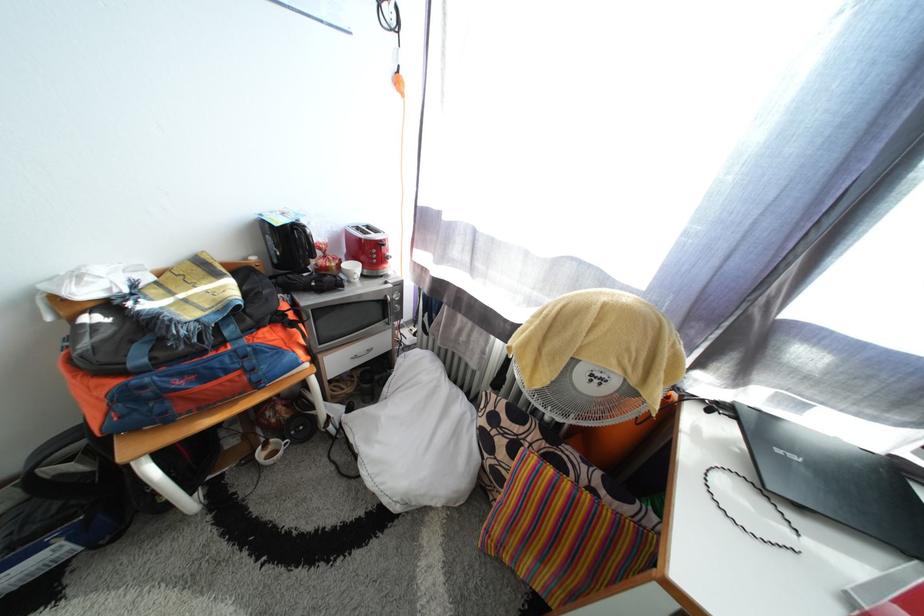
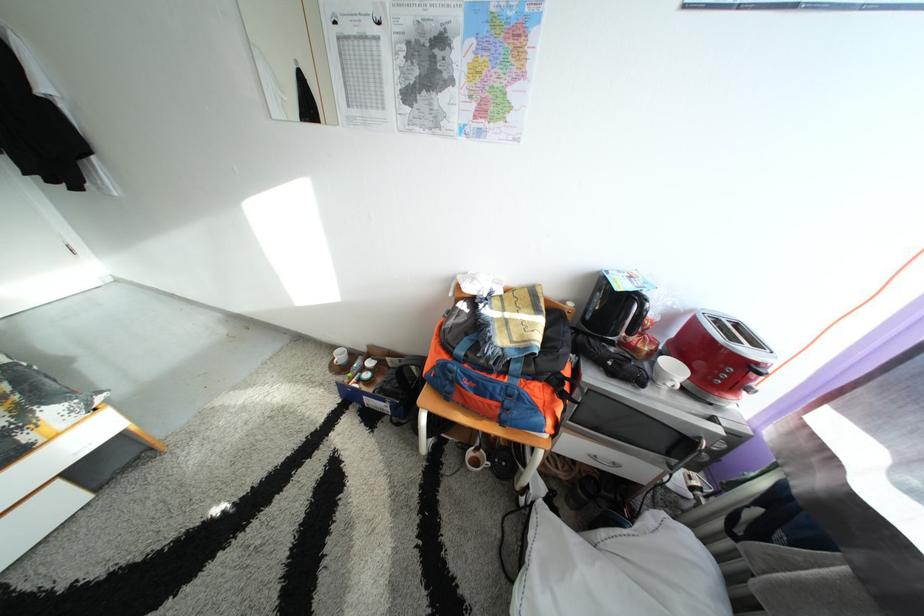
Where in the second image is the point corresponding to point (390, 246) from the first image?

(767, 370)